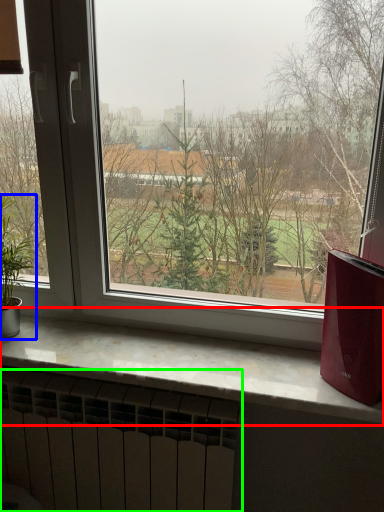
Question: Considering the real-world distances, which object is closest to window sill (highlighted by a red box)? houseplant (highlighted by a blue box) or radiator (highlighted by a green box).

Choices:
 (A) houseplant
 (B) radiator

Answer: (B)